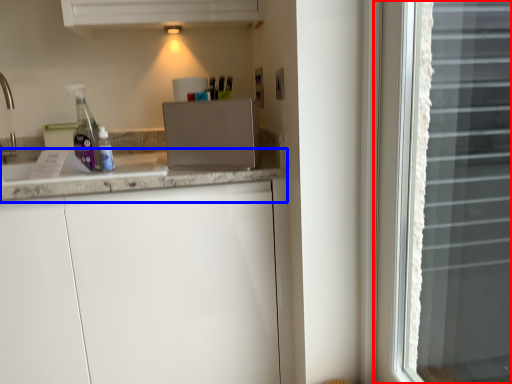
Question: Which of the following is the closest to the observer, window (highlighted by a red box) or countertop (highlighted by a blue box)?

Choices:
 (A) window
 (B) countertop

Answer: (A)